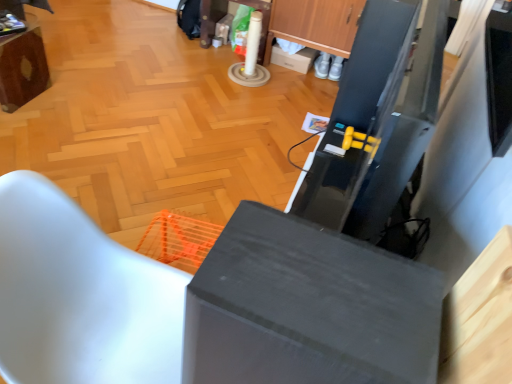
Find the location of a particular element. This screenshot has width=512, height=384. empty space that is to the right of wooden table at upper left, positioned as the 1th furniture in back-to-front order is located at coordinates (59, 106).